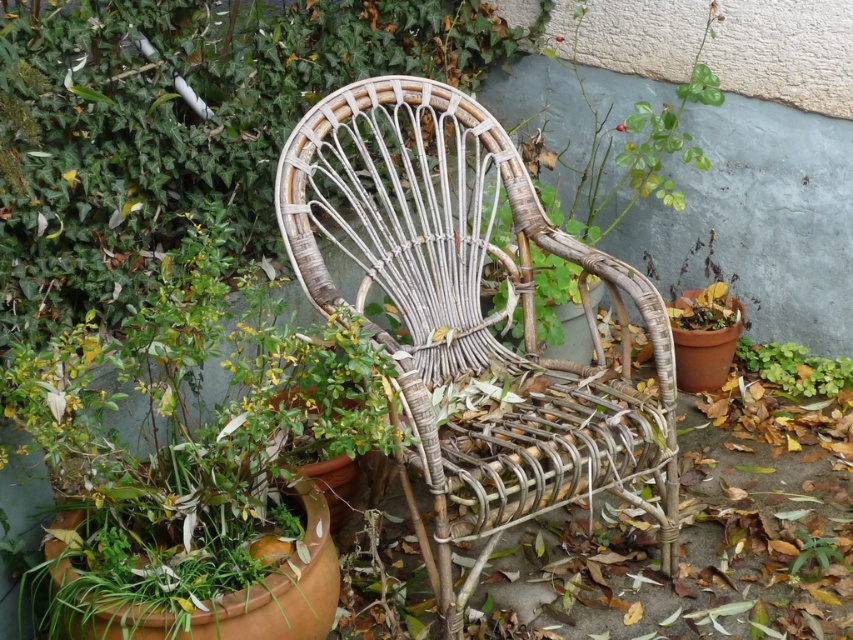
In order to click on woven bamboo chair at center in this screenshot , I will do `click(468, 310)`.

Does woven bamboo chair at center lie in front of green leafy plant at lower center?

Yes, woven bamboo chair at center is in front of green leafy plant at lower center.

The width and height of the screenshot is (853, 640). I want to click on woven bamboo chair at center, so click(x=468, y=310).

Can you confirm if green leafy plant at center is smaller than green leafy plant at lower center?

Incorrect, green leafy plant at center is not smaller in size than green leafy plant at lower center.

Between green leafy plant at center and green leafy plant at lower center, which one appears on the right side from the viewer's perspective?

green leafy plant at lower center

Is point (624, 173) in front of point (830, 552)?

That is False.

This screenshot has width=853, height=640. Find the location of `green leafy plant at center`. green leafy plant at center is located at coordinates (637, 144).

Is woven bamboo chair at center shorter than green leafy plant at lower right?

No, woven bamboo chair at center is not shorter than green leafy plant at lower right.

Between woven bamboo chair at center and green leafy plant at lower right, which one has less height?

With less height is green leafy plant at lower right.

Which is in front, point (584, 371) or point (788, 356)?

Positioned in front is point (584, 371).

Image resolution: width=853 pixels, height=640 pixels. I want to click on woven bamboo chair at center, so click(468, 310).